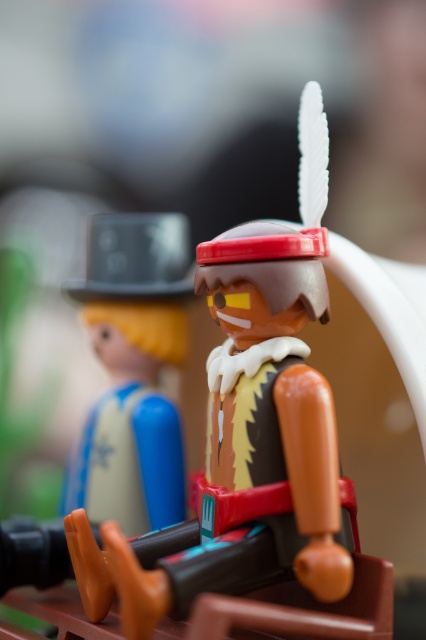
You are a child who wants to stack the matte plastic toy at center and the matte black hat at left. Can you place the smaller one on top of the taller one?

The matte plastic toy at center is much taller than the matte black hat at left, so you can place the matte black hat at left on top of the matte plastic toy at center.

From the picture: You are a collector looking to display your Playmobil figures. You have a matte plastic toy at center marked by point (250, 428) and another figure in the foreground. Which figure is closer to the viewer?

The foreground figure is closer to the viewer than the matte plastic toy at center marked by point (250, 428).

You are a child playing with toys and see the matte plastic toy at center and the matte black hat at left. Which toy is positioned more to the right side?

The matte plastic toy at center is positioned more to the right side than the matte black hat at left.